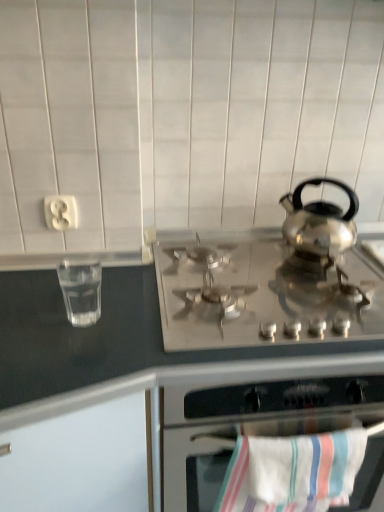
Locate an element on the screen. This screenshot has width=384, height=512. satin silver gas stove at center is located at coordinates point(261,292).

From a real-world perspective, is clear glass water at left located higher than white plastic outlet at upper left?

No, from a real-world perspective, clear glass water at left is not on top of white plastic outlet at upper left.

In the image, is clear glass water at left positioned in front of or behind white plastic outlet at upper left?

In the image, clear glass water at left appears in front of white plastic outlet at upper left.

Based on their sizes in the image, would you say clear glass water at left is bigger or smaller than white plastic outlet at upper left?

Considering their sizes, clear glass water at left takes up more space than white plastic outlet at upper left.

Is clear glass water at left positioned beyond the bounds of white plastic outlet at upper left?

clear glass water at left is positioned outside white plastic outlet at upper left.

Is striped cotton beach towel at lower center not inside clear glass water at left?

Yes, striped cotton beach towel at lower center is not within clear glass water at left.

From a real-world perspective, between striped cotton beach towel at lower center and clear glass water at left, who is vertically lower?

From a 3D spatial view, striped cotton beach towel at lower center is below.

Who is smaller, striped cotton beach towel at lower center or clear glass water at left?

clear glass water at left.

Considering the sizes of objects striped cotton beach towel at lower center and white plastic outlet at upper left in the image provided, who is shorter, striped cotton beach towel at lower center or white plastic outlet at upper left?

With less height is white plastic outlet at upper left.

From the image's perspective, relative to white plastic outlet at upper left, is striped cotton beach towel at lower center above or below?

From the image's perspective, striped cotton beach towel at lower center appears below white plastic outlet at upper left.

In terms of size, does striped cotton beach towel at lower center appear bigger or smaller than white plastic outlet at upper left?

striped cotton beach towel at lower center is bigger than white plastic outlet at upper left.

Is striped cotton beach towel at lower center with satin silver gas stove at center?

No, striped cotton beach towel at lower center is not beside satin silver gas stove at center.

Does striped cotton beach towel at lower center have a greater height compared to satin silver gas stove at center?

Yes.

From the image's perspective, is striped cotton beach towel at lower center over satin silver gas stove at center?

No.

Considering the positions of point (251, 443) and point (285, 278), is point (251, 443) closer or farther from the camera than point (285, 278)?

Point (251, 443).

Is stainless steel gas stove at center located within striped cotton beach towel at lower center?

That's incorrect, stainless steel gas stove at center is not inside striped cotton beach towel at lower center.

Is striped cotton beach towel at lower center beside stainless steel gas stove at center?

They are not placed beside each other.

Is striped cotton beach towel at lower center smaller than stainless steel gas stove at center?

Yes.

Is striped cotton beach towel at lower center further to camera compared to stainless steel gas stove at center?

Yes, it is behind stainless steel gas stove at center.

Which is behind, point (148, 386) or point (48, 227)?

The point (48, 227) is behind.

Can you confirm if stainless steel gas stove at center is taller than white plastic outlet at upper left?

Yes.

Does stainless steel gas stove at center contain white plastic outlet at upper left?

No, white plastic outlet at upper left is not surrounded by stainless steel gas stove at center.

Based on the photo, measure the distance between stainless steel gas stove at center and white plastic outlet at upper left.

stainless steel gas stove at center and white plastic outlet at upper left are 51.42 centimeters apart.

Identify the location of appliance below the satin silver gas stove at center (from the image's perspective). Image resolution: width=384 pixels, height=512 pixels. (81, 292).

In terms of width, does clear glass water at left look wider or thinner when compared to satin silver gas stove at center?

Clearly, clear glass water at left has less width compared to satin silver gas stove at center.

Between clear glass water at left and satin silver gas stove at center, which one has smaller size?

With smaller size is clear glass water at left.

Based on the photo, between clear glass water at left and satin silver gas stove at center, which one is positioned in front?

satin silver gas stove at center is closer to the camera.

Locate an element on the screen. The width and height of the screenshot is (384, 512). appliance to the right of white plastic outlet at upper left is located at coordinates (81, 292).

This screenshot has width=384, height=512. Find the location of `appliance on the left of the striped cotton beach towel at lower center`. appliance on the left of the striped cotton beach towel at lower center is located at coordinates (81, 292).

Considering their positions, is clear glass water at left positioned closer to striped cotton beach towel at lower center than white plastic outlet at upper left?

The object closer to striped cotton beach towel at lower center is clear glass water at left.

Which object lies further to the anchor point stainless steel gas stove at center, striped cotton beach towel at lower center or clear glass water at left?

clear glass water at left.

Considering their positions, is satin silver gas stove at center positioned further to white plastic outlet at upper left than clear glass water at left?

satin silver gas stove at center lies further to white plastic outlet at upper left than the other object.

Estimate the real-world distances between objects in this image. Which object is closer to stainless steel gas stove at center, satin silver gas stove at center or clear glass water at left?

Based on the image, satin silver gas stove at center appears to be nearer to stainless steel gas stove at center.

Consider the image. From the image, which object appears to be farther from striped cotton beach towel at lower center, satin silver gas stove at center or stainless steel gas stove at center?

Among the two, satin silver gas stove at center is located further to striped cotton beach towel at lower center.

Estimate the real-world distances between objects in this image. Which object is further from clear glass water at left, white plastic outlet at upper left or striped cotton beach towel at lower center?

striped cotton beach towel at lower center lies further to clear glass water at left than the other object.

Which object lies nearer to the anchor point satin silver gas stove at center, striped cotton beach towel at lower center or clear glass water at left?

striped cotton beach towel at lower center is positioned closer to the anchor satin silver gas stove at center.

Based on their spatial positions, is clear glass water at left or striped cotton beach towel at lower center further from white plastic outlet at upper left?

striped cotton beach towel at lower center lies further to white plastic outlet at upper left than the other object.

The width and height of the screenshot is (384, 512). What are the coordinates of `appliance between white plastic outlet at upper left and stainless steel gas stove at center in the horizontal direction` in the screenshot? It's located at (81, 292).

This screenshot has height=512, width=384. I want to click on countertop between satin silver gas stove at center and striped cotton beach towel at lower center from top to bottom, so click(x=198, y=345).

The width and height of the screenshot is (384, 512). Identify the location of gas stove situated between clear glass water at left and stainless steel gas stove at center from left to right. (261, 292).

Identify the location of beach towel between white plastic outlet at upper left and satin silver gas stove at center. (292, 472).